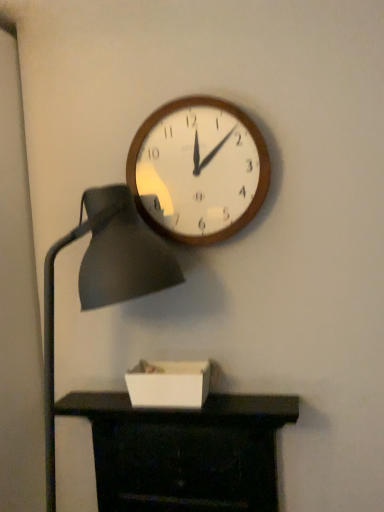
Question: Considering the relative positions of white matte box at lower center and matte black fireplace at lower center in the image provided, is white matte box at lower center to the right of matte black fireplace at lower center from the viewer's perspective?

Choices:
 (A) yes
 (B) no

Answer: (A)

Question: Is white matte box at lower center in contact with matte black fireplace at lower center?

Choices:
 (A) yes
 (B) no

Answer: (B)

Question: From a real-world perspective, is white matte box at lower center physically below matte black fireplace at lower center?

Choices:
 (A) yes
 (B) no

Answer: (B)

Question: From a real-world perspective, is white matte box at lower center on matte black fireplace at lower center?

Choices:
 (A) yes
 (B) no

Answer: (A)

Question: Is white matte box at lower center turned away from matte black fireplace at lower center?

Choices:
 (A) yes
 (B) no

Answer: (B)

Question: In terms of width, does matte black lampshade at left look wider or thinner when compared to matte black fireplace at lower center?

Choices:
 (A) wide
 (B) thin

Answer: (A)

Question: Relative to matte black fireplace at lower center, is matte black lampshade at left in front or behind?

Choices:
 (A) behind
 (B) front

Answer: (B)

Question: In terms of height, does matte black lampshade at left look taller or shorter compared to matte black fireplace at lower center?

Choices:
 (A) short
 (B) tall

Answer: (B)

Question: Considering the positions of point (105, 234) and point (190, 503), is point (105, 234) closer or farther from the camera than point (190, 503)?

Choices:
 (A) closer
 (B) farther

Answer: (A)

Question: Looking at the image, does wooden wall clock at upper center seem bigger or smaller compared to matte black fireplace at lower center?

Choices:
 (A) big
 (B) small

Answer: (B)

Question: Is wooden wall clock at upper center wider or thinner than matte black fireplace at lower center?

Choices:
 (A) wide
 (B) thin

Answer: (B)

Question: In terms of height, does wooden wall clock at upper center look taller or shorter compared to matte black fireplace at lower center?

Choices:
 (A) tall
 (B) short

Answer: (B)

Question: Is wooden wall clock at upper center inside the boundaries of matte black fireplace at lower center, or outside?

Choices:
 (A) inside
 (B) outside

Answer: (B)

Question: In terms of height, does matte black fireplace at lower center look taller or shorter compared to wooden wall clock at upper center?

Choices:
 (A) short
 (B) tall

Answer: (B)

Question: Relative to wooden wall clock at upper center, is matte black fireplace at lower center in front or behind?

Choices:
 (A) behind
 (B) front

Answer: (B)